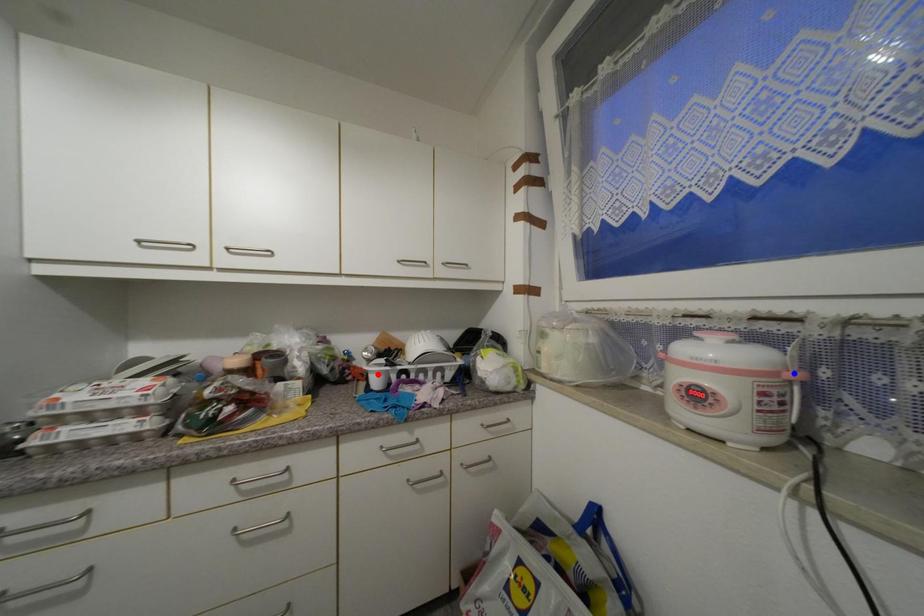
Question: In the image, two points are highlighted. Which point is nearer to the camera? Reply with the corresponding letter.

Choices:
 (A) blue point
 (B) red point

Answer: (A)